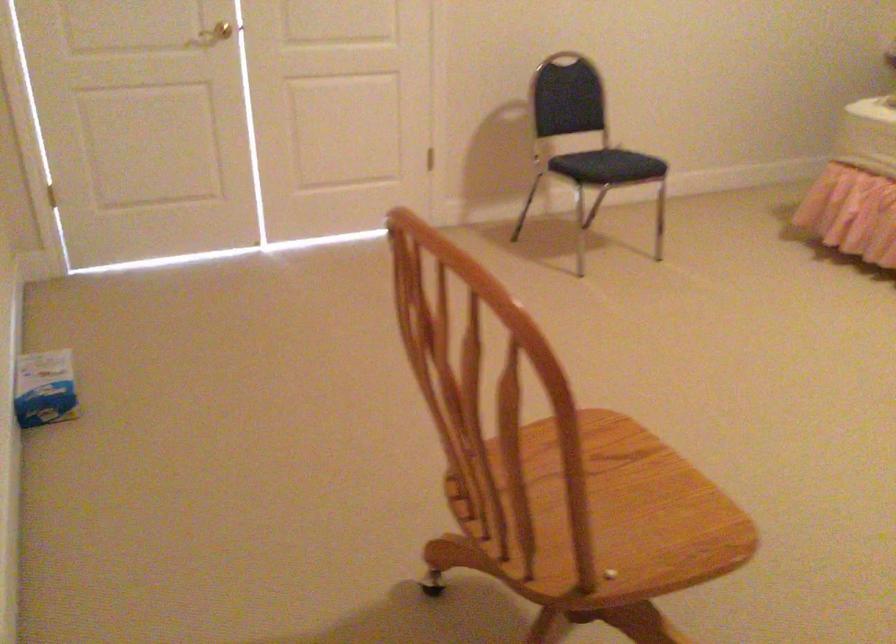
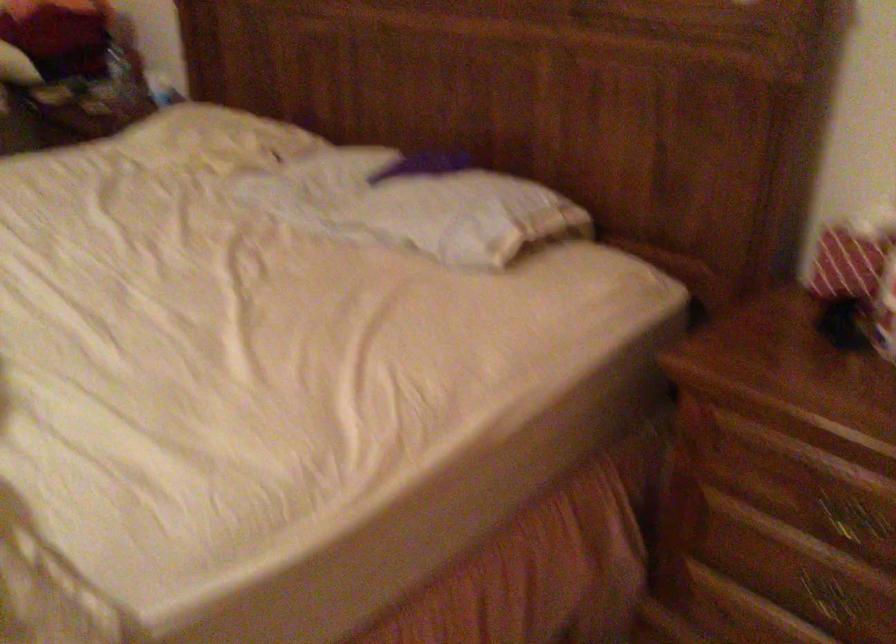
What movement of the cameraman would produce the second image?

The movement direction of the cameraman is right, forward.